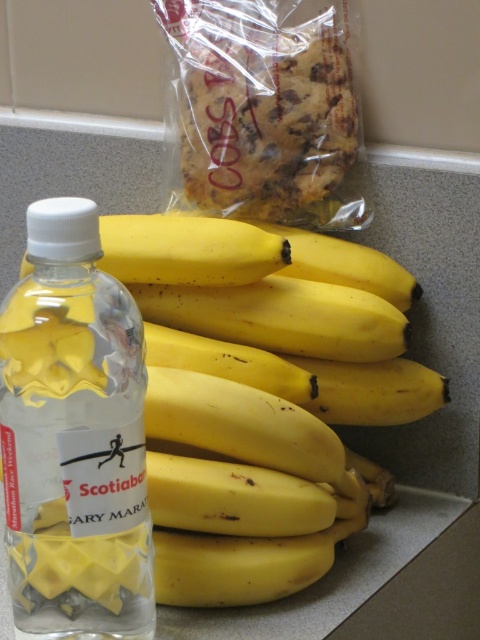
Question: Which is nearer to the yellow matte bananas at center?

Choices:
 (A) clear plastic bottle at left
 (B) golden brown cookie at upper center

Answer: (A)

Question: Among these points, which one is nearest to the camera?

Choices:
 (A) (127, 429)
 (B) (394, 400)

Answer: (A)

Question: Is yellow matte bananas at center below golden brown cookie at upper center?

Choices:
 (A) yes
 (B) no

Answer: (A)

Question: Considering the real-world distances, which object is farthest from the yellow matte bananas at center?

Choices:
 (A) golden brown cookie at upper center
 (B) clear plastic bottle at left

Answer: (A)

Question: Can you confirm if clear plastic bottle at left is thinner than golden brown cookie at upper center?

Choices:
 (A) no
 (B) yes

Answer: (B)

Question: Observing the image, what is the correct spatial positioning of yellow matte bananas at center in reference to golden brown cookie at upper center?

Choices:
 (A) below
 (B) above

Answer: (A)